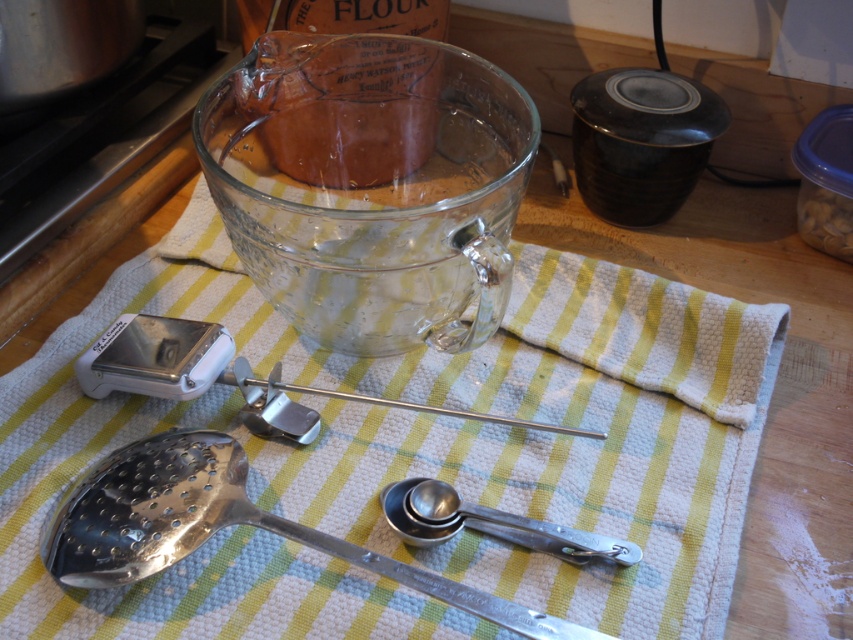
You are arranging items on the kitchen countertop and notice the polished metal slotted spoon at lower left and the white woven cloth at center. Which object is closer to you?

The white woven cloth at center is closer to you because the polished metal slotted spoon at lower left is behind it.

You are looking at the kitchen countertop scene. There are two points marked on the image. Which point, point (473, 628) or point (610, 538), is closer to you?

Point (473, 628) is closer to the viewer than point (610, 538).

You are organizing the kitchen utensils on the striped cloth. You need to place a new spice jar between the polished metal slotted spoon at lower left and the silver metallic measuring spoons at center. Based on their positions, where should you position the spice jar?

The polished metal slotted spoon at lower left is in front of the silver metallic measuring spoons at center. To place the spice jar between them, position it behind the slotted spoon but in front of the measuring spoons, ensuring it sits between their layers in the depth of the scene.